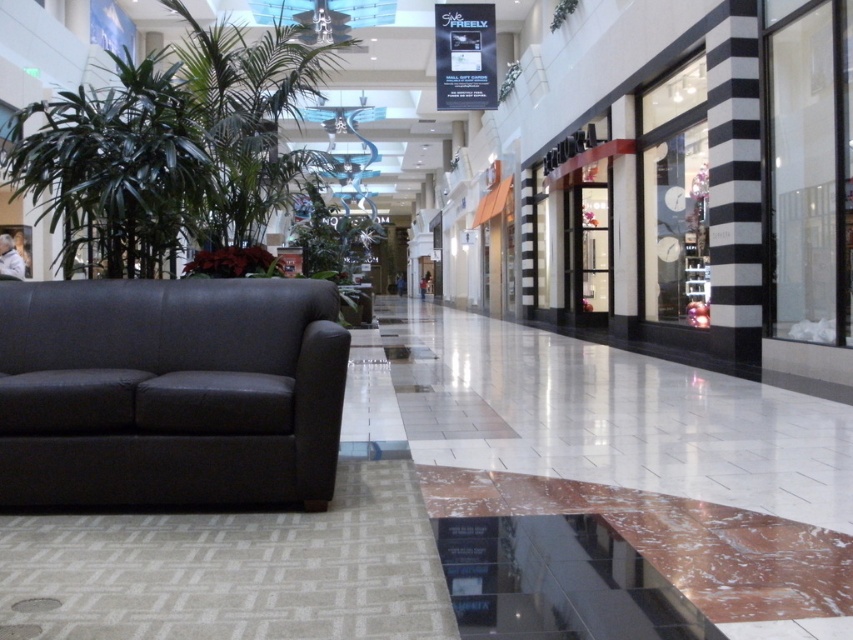
Question: Can you confirm if matte black couch at left is smaller than green leafy plant at left?

Choices:
 (A) yes
 (B) no

Answer: (A)

Question: Can you confirm if matte black couch at left is bigger than green leafy plant at left?

Choices:
 (A) no
 (B) yes

Answer: (A)

Question: Considering the relative positions of matte black couch at left and green leafy plant at left in the image provided, where is matte black couch at left located with respect to green leafy plant at left?

Choices:
 (A) above
 (B) below

Answer: (B)